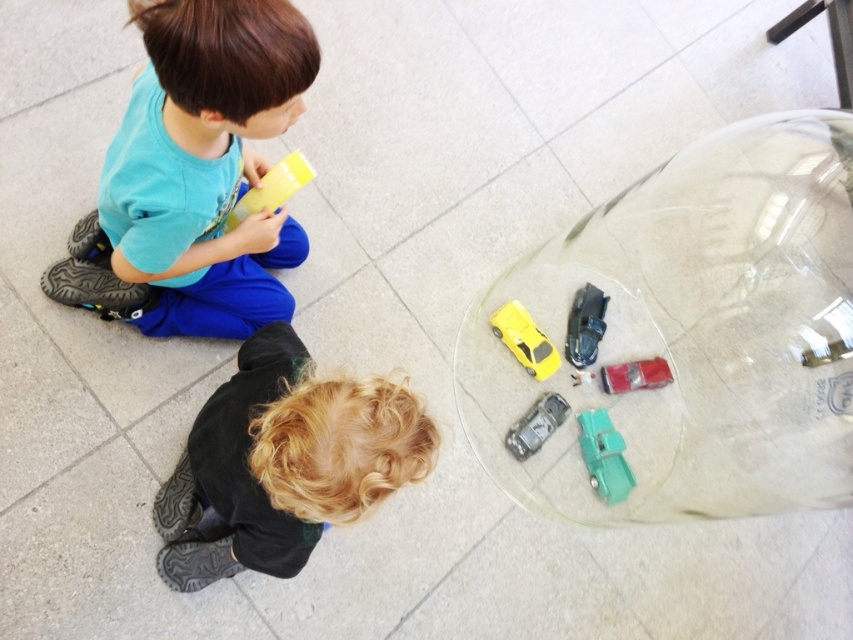
You are a parent trying to organize your childrens toys. You have a storage bin that is 12 inches wide. Can both the matte green car at lower right and the yellow matte car at lower center fit side by side in the bin?

The matte green car at lower right is 10.91 inches from the yellow matte car at lower center. Since the distance between them is less than the bin width of 12 inches, they can fit side by side in the bin.

Please look at the image and locate the point with coordinates (604, 456). What object is exactly at that point?

The matte green car at lower right is exactly at point (604, 456).